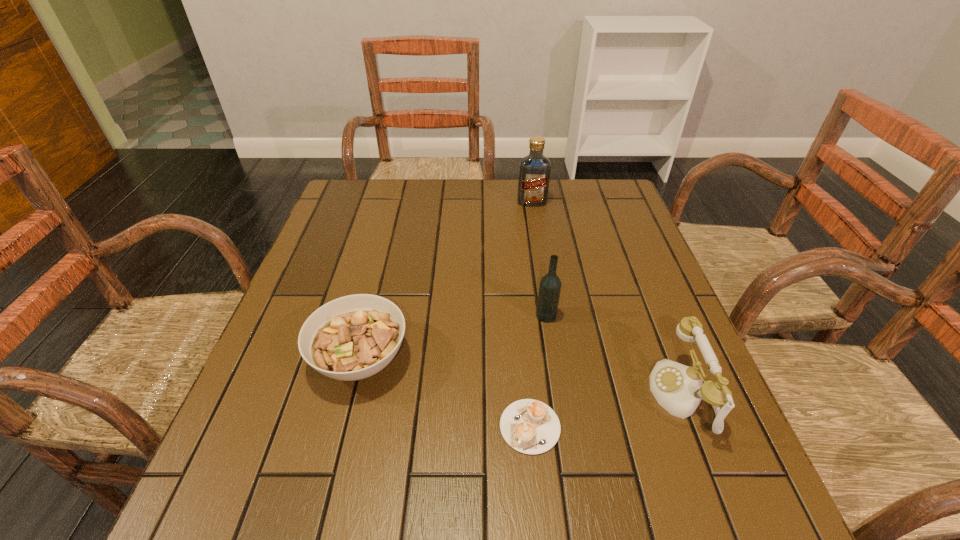
I want to click on vacant space at the near edge of the desktop, so click(x=406, y=535).

The height and width of the screenshot is (540, 960). In order to click on vacant space at the left edge in this screenshot , I will do `click(301, 305)`.

Locate an element on the screen. The width and height of the screenshot is (960, 540). vacant space at the right edge of the desktop is located at coordinates (663, 321).

The height and width of the screenshot is (540, 960). Find the location of `free location at the far left corner`. free location at the far left corner is located at coordinates (342, 219).

I want to click on free space at the near right corner of the desktop, so click(748, 496).

Where is `vacant space that is in between the nearer vodka and the third shortest object`? Image resolution: width=960 pixels, height=540 pixels. vacant space that is in between the nearer vodka and the third shortest object is located at coordinates (614, 355).

At what (x,y) coordinates should I click in order to perform the action: click on vacant area between the stew and the taller vodka. Please return your answer as a coordinate pair (x, y). The width and height of the screenshot is (960, 540). Looking at the image, I should click on (446, 280).

Find the location of a particular element. Image resolution: width=960 pixels, height=540 pixels. free spot between the stew and the shortest object is located at coordinates [x=445, y=393].

This screenshot has width=960, height=540. Find the location of `free space that is in between the cappuccino and the stew`. free space that is in between the cappuccino and the stew is located at coordinates (445, 393).

I want to click on blank region between the taller vodka and the stew, so [446, 280].